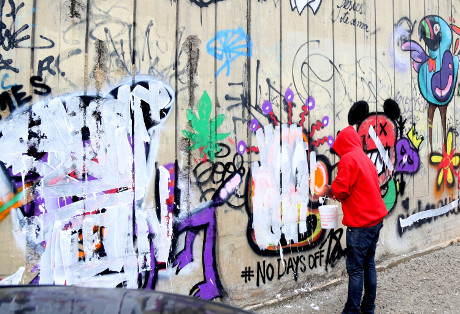
I want to click on fresh paint, so click(283, 188), click(274, 185), click(266, 179), click(297, 151), click(267, 152).